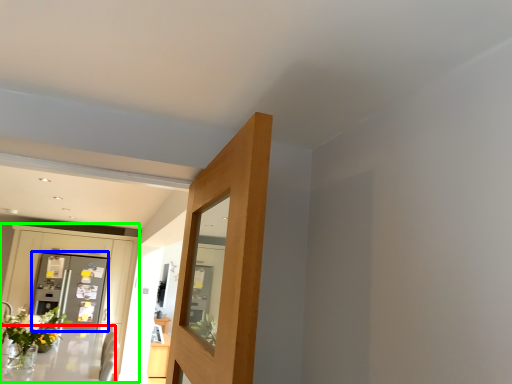
Question: Based on their relative distances, which object is nearer to table (highlighted by a red box)? Choose from screen door (highlighted by a blue box) and dresser (highlighted by a green box).

Choices:
 (A) screen door
 (B) dresser

Answer: (A)